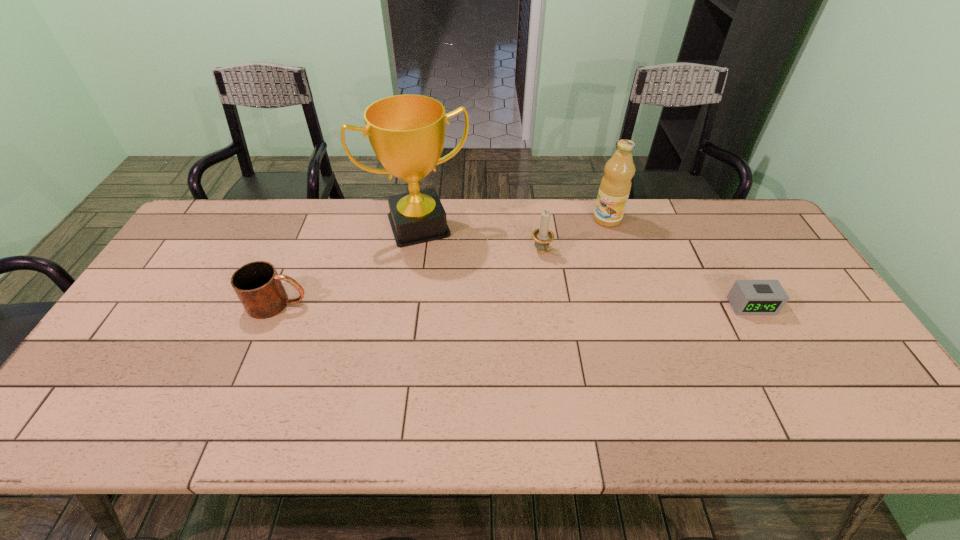
This screenshot has width=960, height=540. I want to click on free space located 0.380m on the side of the mug with the handle, so point(447,303).

Where is `vacant point located 0.100m on the front-facing side of the shortest object`? The width and height of the screenshot is (960, 540). vacant point located 0.100m on the front-facing side of the shortest object is located at coordinates (774, 346).

Where is `vacant space located 0.100m on the front-facing side of the second object from left to right`? vacant space located 0.100m on the front-facing side of the second object from left to right is located at coordinates (442, 268).

The image size is (960, 540). Find the location of `vacant area situated on the front-facing side of the second object from left to right`. vacant area situated on the front-facing side of the second object from left to right is located at coordinates (469, 339).

Locate an element on the screen. The height and width of the screenshot is (540, 960). free space located on the front-facing side of the second object from left to right is located at coordinates (447, 285).

This screenshot has height=540, width=960. I want to click on free space located 0.270m on the handle side of the candle_holder, so click(599, 326).

Where is `free space located 0.190m on the handle side of the candle_holder`? free space located 0.190m on the handle side of the candle_holder is located at coordinates (582, 305).

Where is `blank space located 0.220m on the handle side of the candle_holder`? blank space located 0.220m on the handle side of the candle_holder is located at coordinates (588, 312).

Image resolution: width=960 pixels, height=540 pixels. I want to click on free region located on the label of the olive oil, so click(579, 246).

Identify the location of free location located 0.190m on the label of the olive oil. (568, 256).